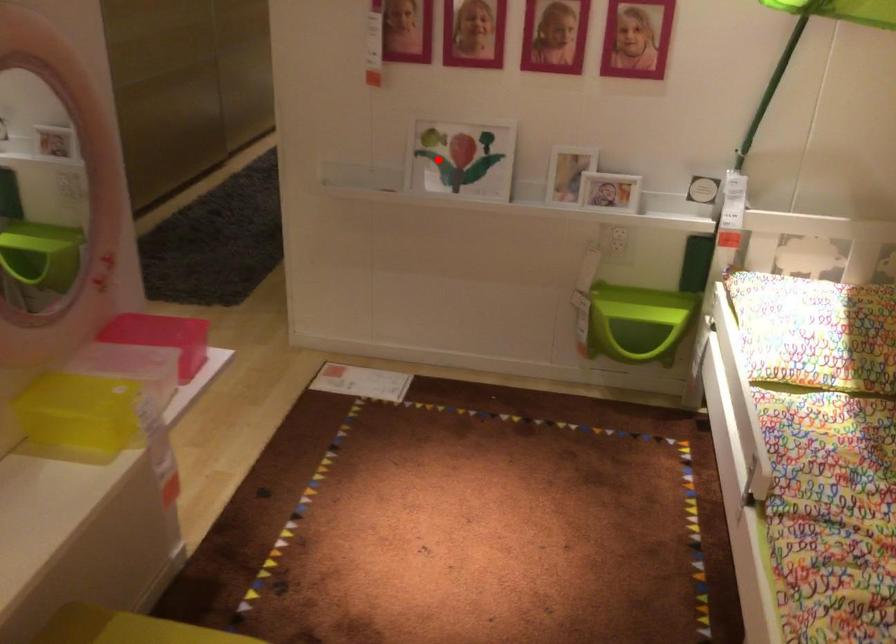
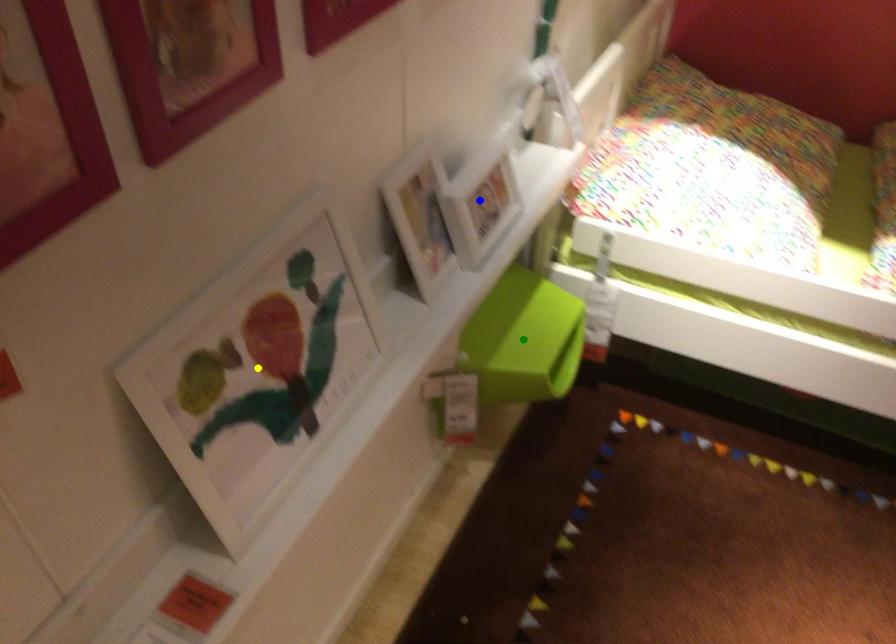
Question: I am providing you with two images of the same scene from different viewpoints. A red point is marked on the first image. You are given multiple points on the second image. Which point in image 2 is actually the same real-world point as the red point in image 1?

Choices:
 (A) green point
 (B) blue point
 (C) yellow point

Answer: (C)